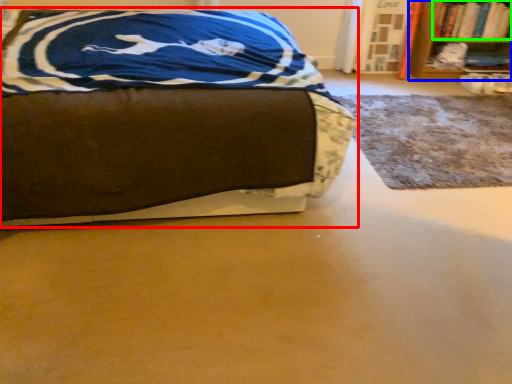
Question: Which is farther away from bed (highlighted by a red box)? bookcase (highlighted by a blue box) or book (highlighted by a green box)?

Choices:
 (A) bookcase
 (B) book

Answer: (B)